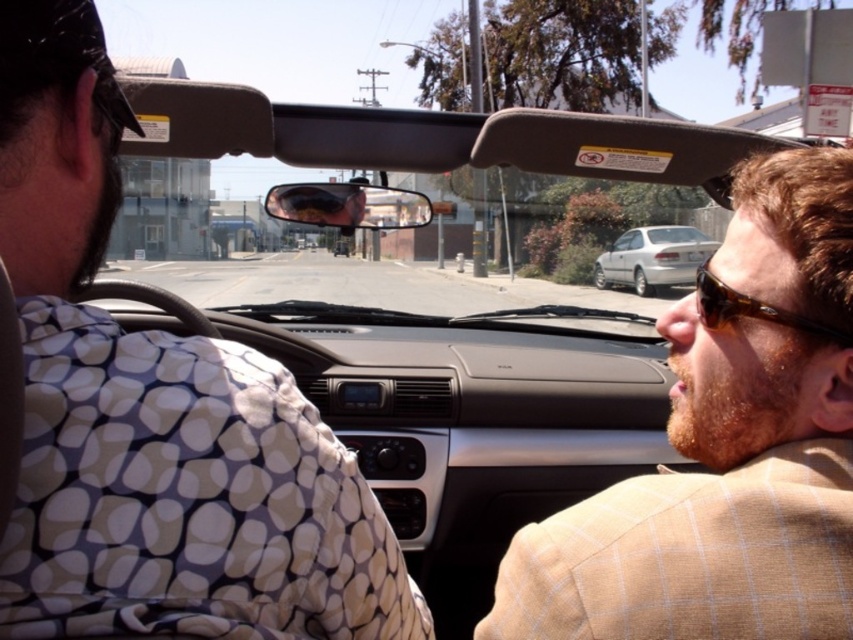
Question: Which object is the farthest from the brown tortoiseshell sunglasses at right?

Choices:
 (A) brown checkered suit at right
 (B) silver metallic sedan at center
 (C) beige textured blazer at left

Answer: (B)

Question: Can you confirm if brown checkered suit at right is wider than brown tortoiseshell sunglasses at right?

Choices:
 (A) yes
 (B) no

Answer: (A)

Question: Which point is farther to the camera?

Choices:
 (A) brown checkered suit at right
 (B) beige textured blazer at left

Answer: (A)

Question: Does brown checkered suit at right come behind silver metallic sedan at center?

Choices:
 (A) yes
 (B) no

Answer: (B)

Question: Which object appears farthest from the camera in this image?

Choices:
 (A) brown tortoiseshell sunglasses at right
 (B) brown checkered suit at right
 (C) beige textured blazer at left
 (D) silver metallic sedan at center

Answer: (D)

Question: Does beige textured blazer at left have a lesser width compared to brown tortoiseshell sunglasses at right?

Choices:
 (A) yes
 (B) no

Answer: (B)